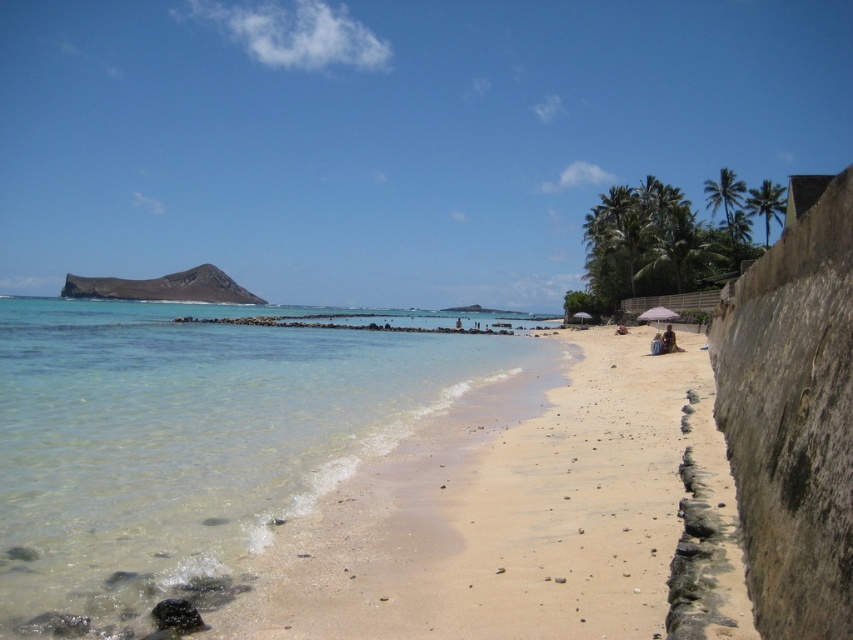
You are standing on the sandy beach at lower right and want to place your blue denim shorts at lower right on the sand. Can you tell me if there is enough space to place them without overlapping the concrete wall?

The sandy beach at lower right might be wider than blue denim shorts at lower right, so there is likely enough space to place them without overlapping the concrete wall.

You are standing at the coordinates where the concrete wall is located on the right side of the beach. If you walk straight towards the center of the beach, will you encounter the beige sand at beach center before reaching the water?

Yes, because the beige sand at beach center is located at point (668, 340), which is between the concrete wall and the water edge, so walking straight towards the center from the wall would reach the beige sand before the water.